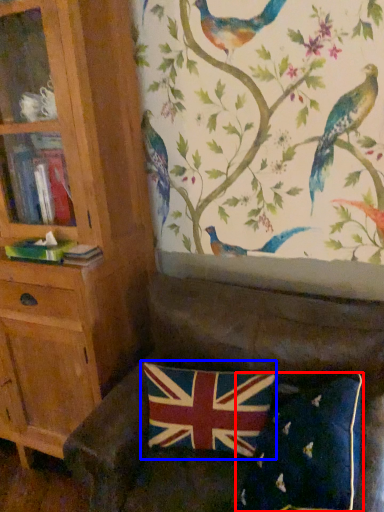
Question: Which object appears farthest to the camera in this image, pillow (highlighted by a red box) or flag (highlighted by a blue box)?

Choices:
 (A) pillow
 (B) flag

Answer: (B)